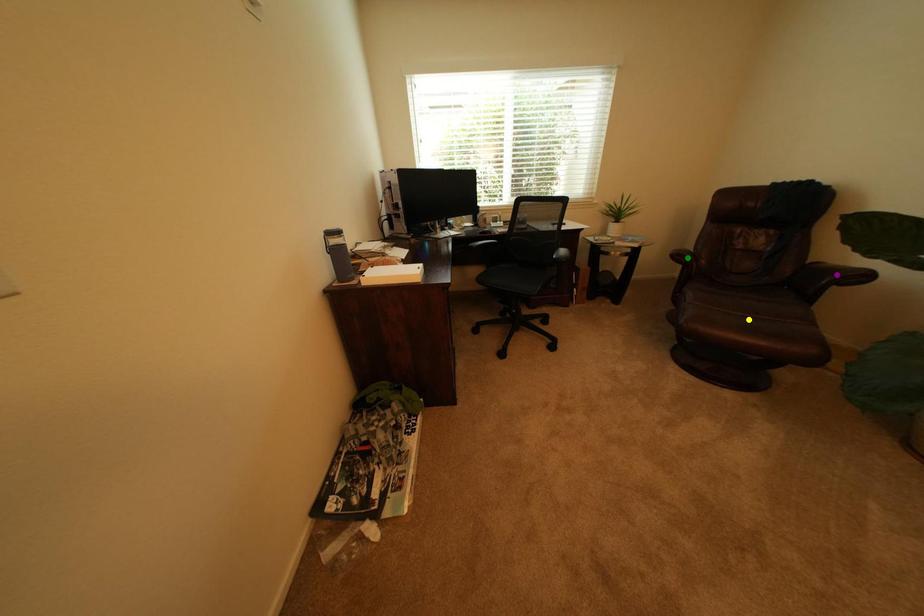
In the scene shown: Order these from nearest to farthest:
- green point
- purple point
- yellow point

green point, yellow point, purple point